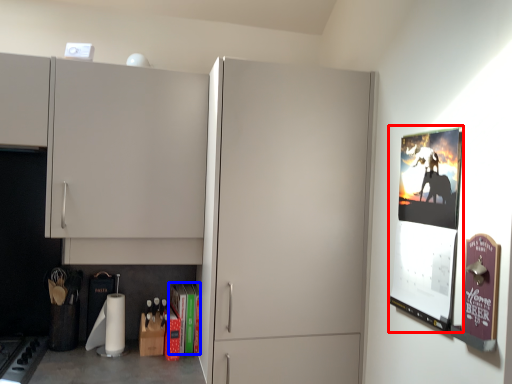
Question: Which object appears farthest to the camera in this image, poster page (highlighted by a red box) or magazine (highlighted by a blue box)?

Choices:
 (A) poster page
 (B) magazine

Answer: (B)